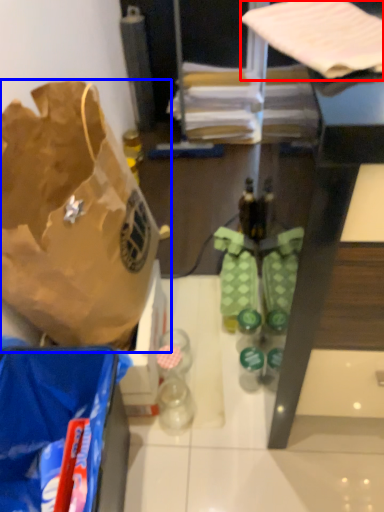
Question: Which object appears closest to the camera in this image, wrapping paper (highlighted by a red box) or handbag (highlighted by a blue box)?

Choices:
 (A) wrapping paper
 (B) handbag

Answer: (A)